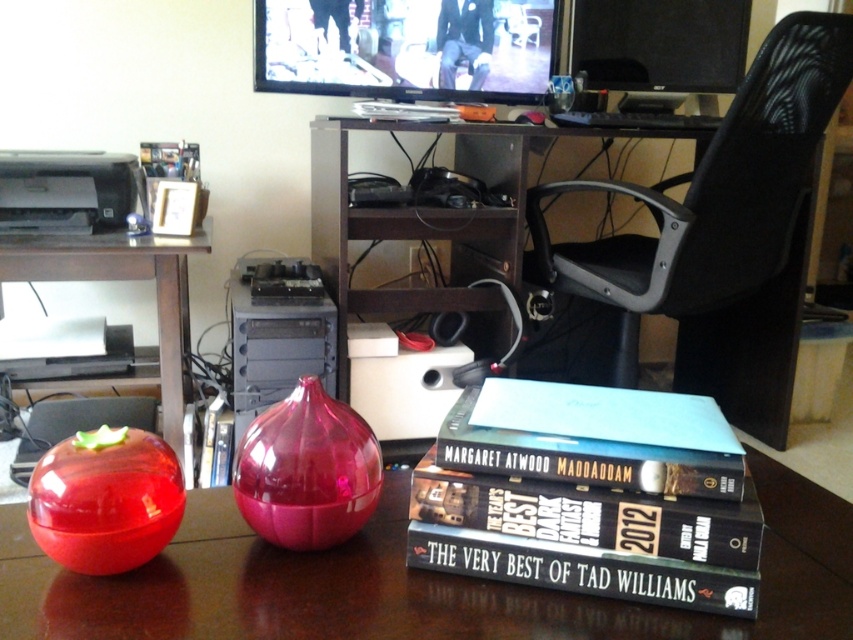
Question: Which point is closer to the camera?

Choices:
 (A) transparent plastic vase at left
 (B) matte black printer at left
 (C) blue matte book at center

Answer: (C)

Question: Is hardcover book at center in front of black matte book at center?

Choices:
 (A) no
 (B) yes

Answer: (B)

Question: Can you confirm if transparent plastic table at center is positioned above transparent plastic vase at left?

Choices:
 (A) yes
 (B) no

Answer: (B)

Question: Which is farther from the blue matte book at center?

Choices:
 (A) black matte book at center
 (B) transparent plastic vase at left
 (C) hardcover book at center
 (D) black mesh computer chair at upper right

Answer: (D)

Question: Which point is closer to the camera?

Choices:
 (A) black mesh computer chair at upper right
 (B) black matte book at center
 (C) matte black printer at left
 (D) blue matte book at center

Answer: (B)

Question: Can you confirm if blue matte book at center is positioned above matte black printer at left?

Choices:
 (A) no
 (B) yes

Answer: (A)